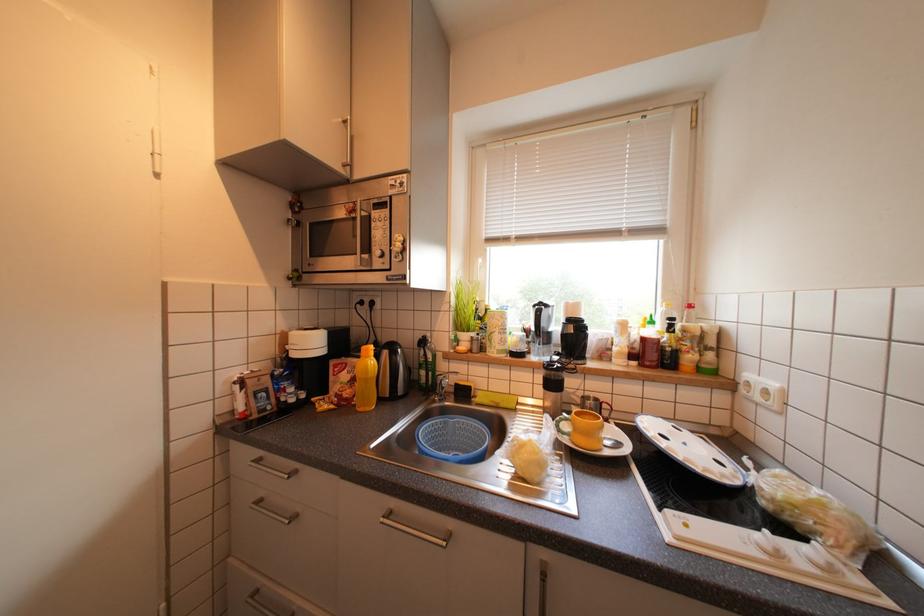
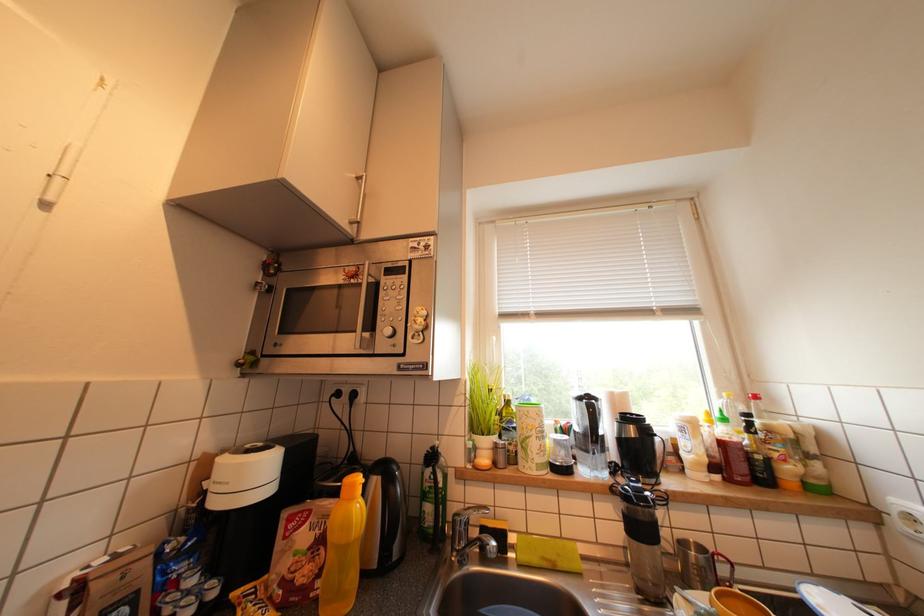
Question: The first image is from the beginning of the video and the second image is from the end. How did the camera likely rotate when shooting the video?

Choices:
 (A) Left
 (B) Right
 (C) Up
 (D) Down

Answer: (C)